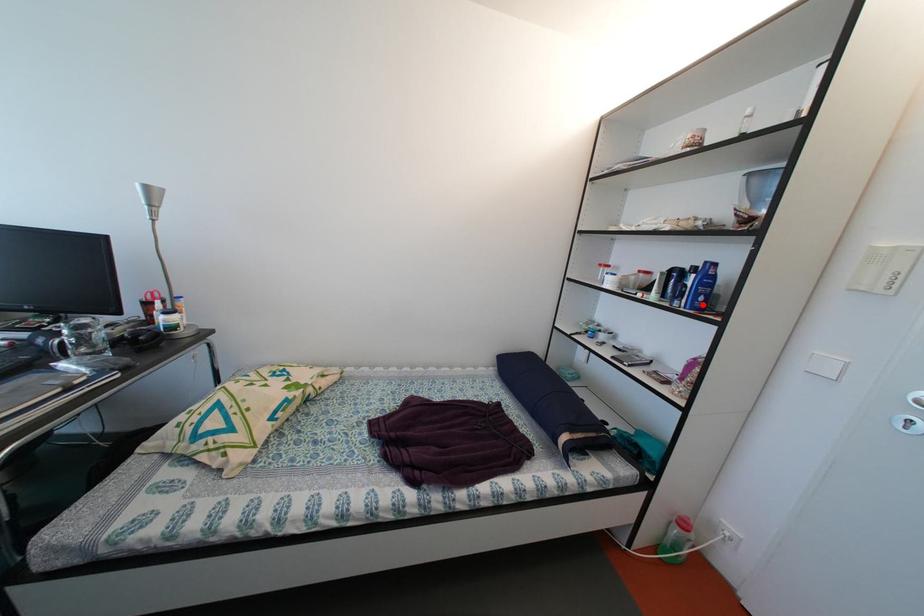
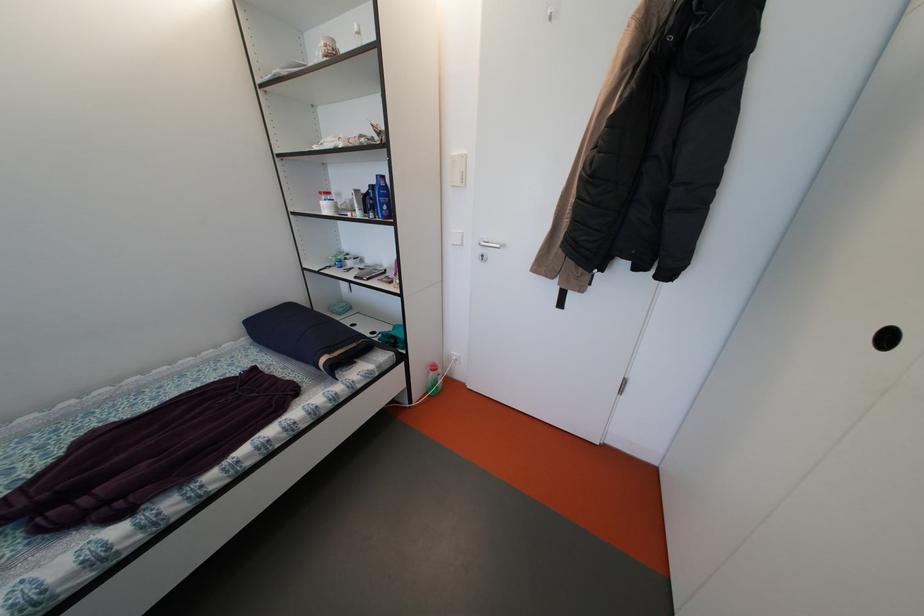
Question: I am providing you with two images of the same scene from different viewpoints. A red point is marked on the first image. At the location where the point appears in image 1, is it still visible in image 2?

Choices:
 (A) Yes
 (B) No

Answer: (A)